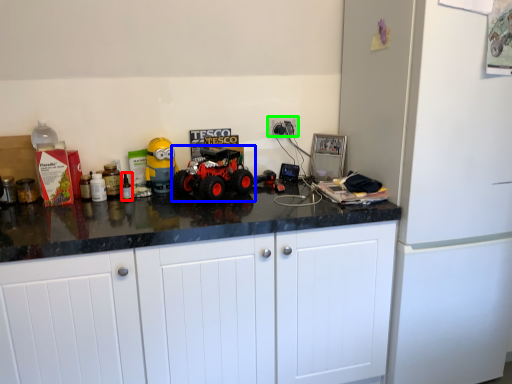
Question: Which object is the farthest from bottle (highlighted by a red box)? Choose among these: land vehicle (highlighted by a blue box) or electric outlet (highlighted by a green box).

Choices:
 (A) land vehicle
 (B) electric outlet

Answer: (B)